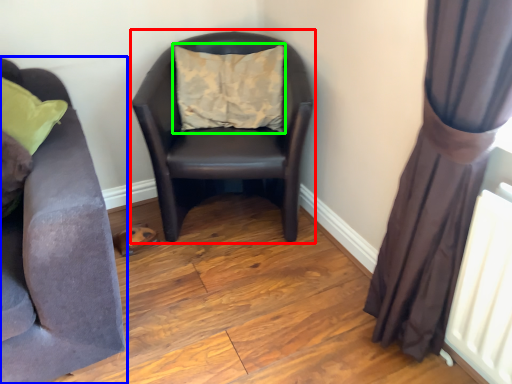
Question: Which object is positioned farthest from rocking chair (highlighted by a red box)? Select from studio couch (highlighted by a blue box) and pillow (highlighted by a green box).

Choices:
 (A) studio couch
 (B) pillow

Answer: (A)